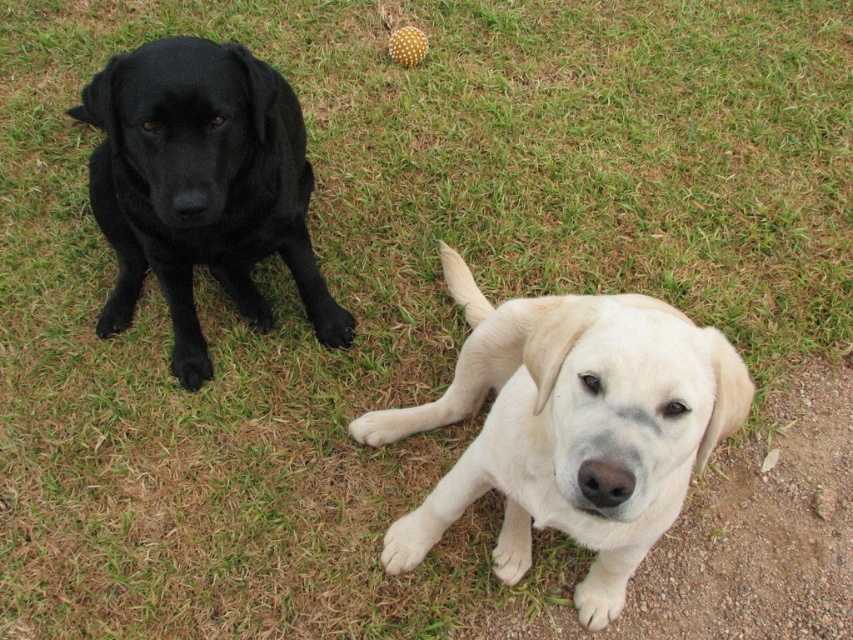
Question: Which point is closer to the camera?

Choices:
 (A) (222, 186)
 (B) (608, 493)

Answer: (B)

Question: Which object appears farthest from the camera in this image?

Choices:
 (A) matte black dog at left
 (B) light beige fur at center

Answer: (A)

Question: Does light beige fur at center appear on the right side of matte black dog at left?

Choices:
 (A) no
 (B) yes

Answer: (B)

Question: Which point is closer to the camera taking this photo?

Choices:
 (A) (689, 476)
 (B) (131, 298)

Answer: (A)

Question: Is light beige fur at center bigger than matte black dog at left?

Choices:
 (A) no
 (B) yes

Answer: (B)

Question: Is light beige fur at center smaller than matte black dog at left?

Choices:
 (A) yes
 (B) no

Answer: (B)